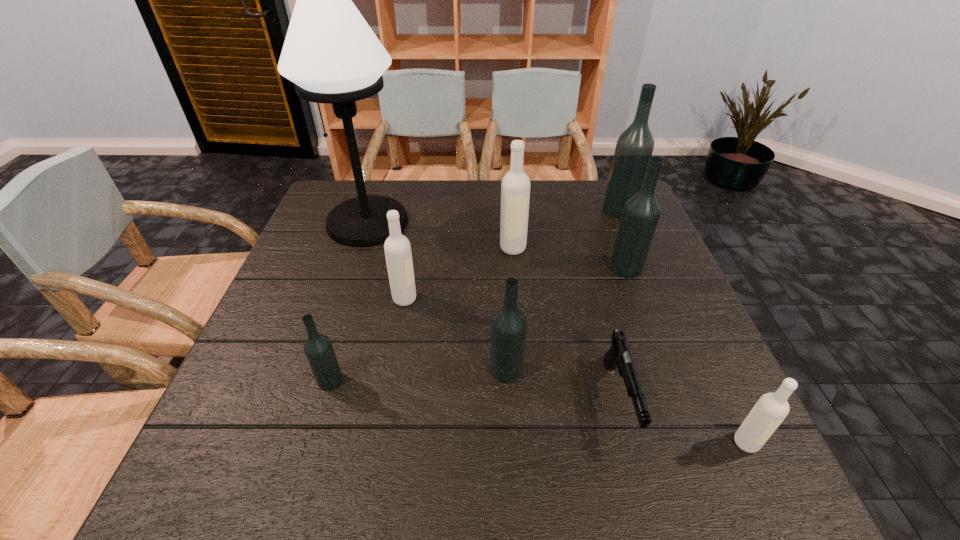
Locate an element on the screen. The height and width of the screenshot is (540, 960). the third biggest black vodka is located at coordinates [x=509, y=325].

Where is `the smallest black vodka`? the smallest black vodka is located at coordinates (318, 348).

Where is `the leftmost vodka`? The width and height of the screenshot is (960, 540). the leftmost vodka is located at coordinates (318, 348).

Identify the location of the nearest white vodka. (771, 409).

Find the location of a particular element. The height and width of the screenshot is (540, 960). the rightmost white vodka is located at coordinates (771, 409).

Image resolution: width=960 pixels, height=540 pixels. I want to click on black gun, so click(x=618, y=355).

Locate an element on the screen. The height and width of the screenshot is (540, 960). the shortest object is located at coordinates (618, 355).

The image size is (960, 540). What are the coordinates of `free space located 0.230m on the front of the tallest object` in the screenshot? It's located at (338, 312).

At what (x,y) coordinates should I click in order to perform the action: click on free spot located 0.150m on the front of the biggest black vodka. Please return your answer as a coordinate pair (x, y). The image size is (960, 540). Looking at the image, I should click on (637, 251).

Locate an element on the screen. The image size is (960, 540). vacant space positioned 0.230m on the right of the farthest white vodka is located at coordinates (612, 248).